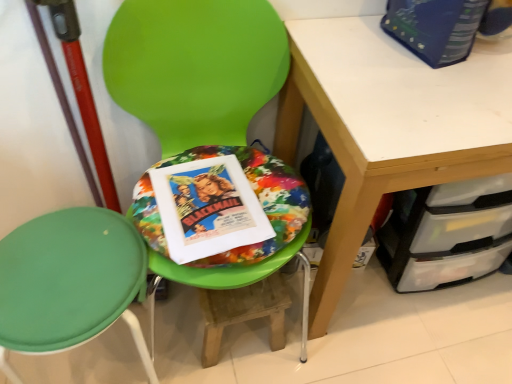
Question: Would you say green plastic chair at center, which is the first chair from right to left, is inside or outside matte paper movie poster at center, the 1th paperback book positioned from the bottom?

Choices:
 (A) outside
 (B) inside

Answer: (A)

Question: Considering the relative positions of green plastic chair at center, which appears as the 2th chair when viewed from the left, and matte paper movie poster at center, the 2th paperback book from the right, in the image provided, is green plastic chair at center, which appears as the 2th chair when viewed from the left, to the left or to the right of matte paper movie poster at center, the 2th paperback book from the right,?

Choices:
 (A) right
 (B) left

Answer: (A)

Question: Considering the real-world distances, which object is farthest from the wooden step stool at center?

Choices:
 (A) green plastic chair at center, which is the first chair from right to left
 (B) matte paper movie poster at center, the 2th paperback book from the right
 (C) green fabric chair at center, the first chair viewed from the left
 (D) white matte desk at upper right
 (E) blue cardboard book at upper right, marked as the 1th paperback book in a top-to-bottom arrangement

Answer: (E)

Question: Estimate the real-world distances between objects in this image. Which object is farther from the green plastic chair at center, which appears as the 2th chair when viewed from the left?

Choices:
 (A) wooden step stool at center
 (B) green fabric chair at center, the first chair viewed from the left
 (C) matte paper movie poster at center, the 2th paperback book from the right
 (D) blue cardboard book at upper right, which ranks as the second paperback book in left-to-right order
 (E) white matte desk at upper right

Answer: (A)